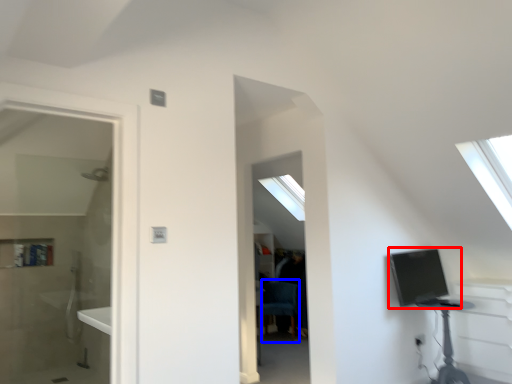
Question: Which point is closer to the camera, computer (highlighted by a red box) or swivel chair (highlighted by a blue box)?

Choices:
 (A) computer
 (B) swivel chair

Answer: (A)